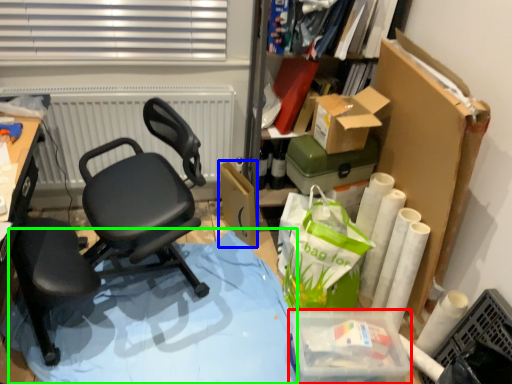
Question: Which is nearer to the storage box (highlighted by a red box)? cardboard box (highlighted by a blue box) or table (highlighted by a green box).

Choices:
 (A) cardboard box
 (B) table

Answer: (B)